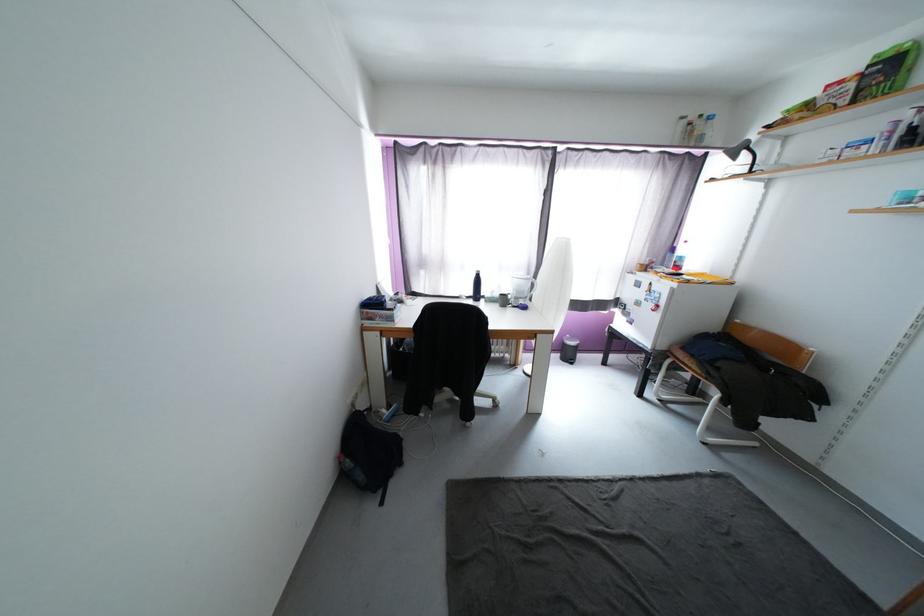
Find where to sit the wooden chair sitting surface. Please return your answer as a coordinate pair (x, y).

(772, 389)